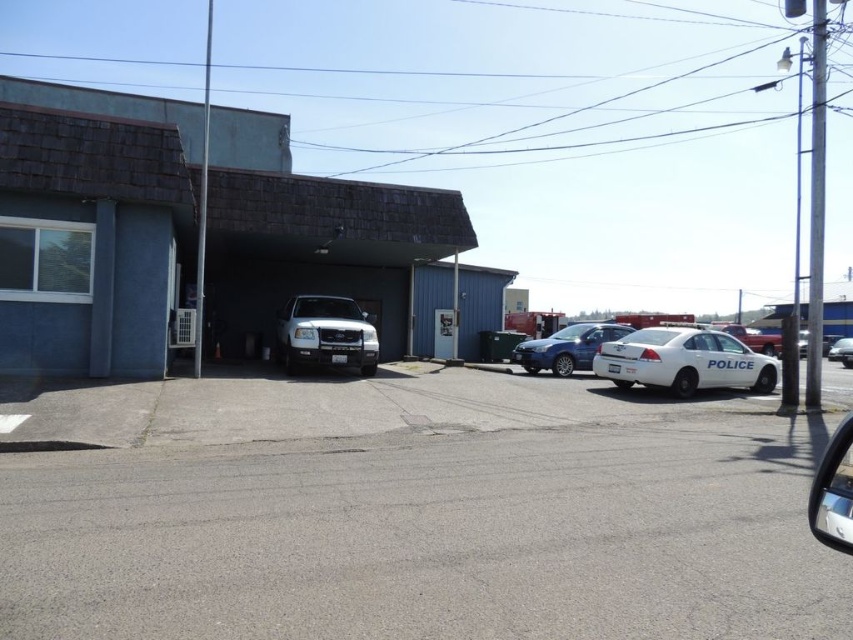
You are a delivery person needing to park your van in the gray asphalt parking lot at lower left. Your van is 18 feet long. Can you safely park your van in that parking lot without it overlapping the white matte suv at center?

The gray asphalt parking lot at lower left is 20.30 feet away from the white matte suv at center. Since your van is 18 feet long, there is enough space between them to park safely without overlapping.